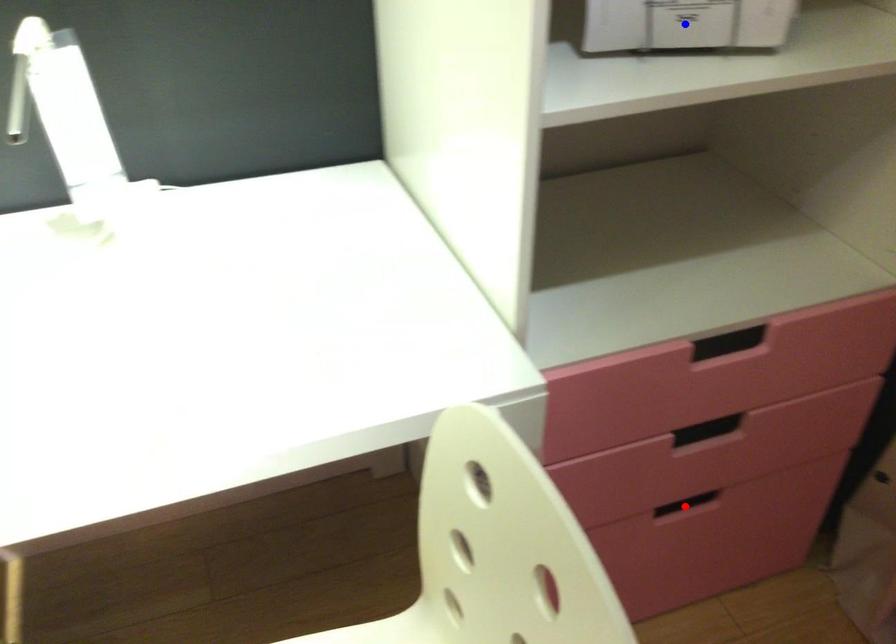
Question: In the image, two points are highlighted. Which point is nearer to the camera? Reply with the corresponding letter.

Choices:
 (A) blue point
 (B) red point

Answer: (A)